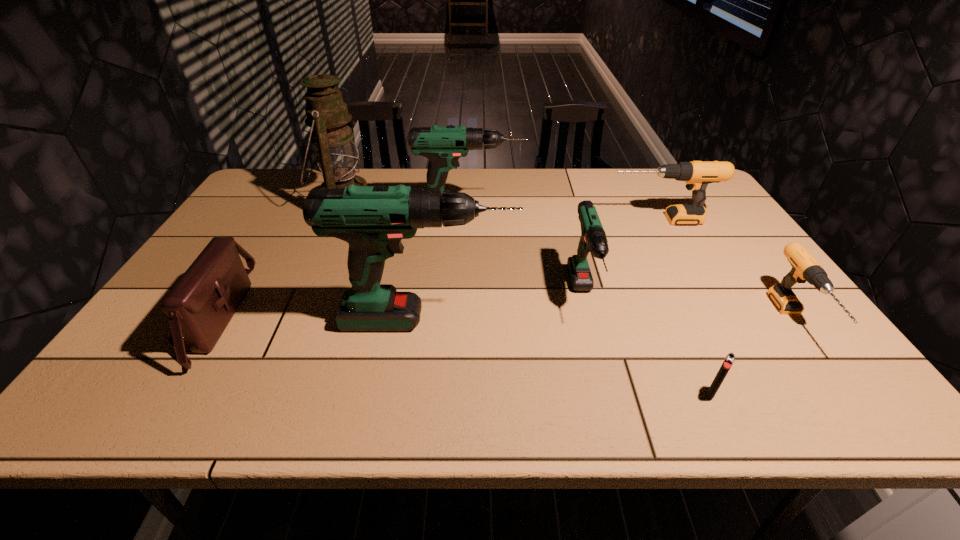
Locate an element on the screen. Image resolution: width=960 pixels, height=540 pixels. the smaller black drill is located at coordinates (805, 268).

Locate an element on the screen. black igniter is located at coordinates (729, 360).

Where is `the shortest object`? The image size is (960, 540). the shortest object is located at coordinates (729, 360).

This screenshot has width=960, height=540. Find the location of `vacant space located on the right of the seventh object from right to left`. vacant space located on the right of the seventh object from right to left is located at coordinates (415, 201).

This screenshot has width=960, height=540. Identify the location of vacant region located 0.210m on the handle side of the tallest drill. (603, 320).

You are a GUI agent. You are given a task and a screenshot of the screen. Output one action in this format:
    pyautogui.click(x=<x>, y=<y>)
    Task: Click on the free region located 0.170m on the handle side of the farthest green drill
    Image resolution: width=960 pixels, height=540 pixels.
    Given the screenshot: What is the action you would take?
    pyautogui.click(x=576, y=214)

Identify the location of vacant point located on the handle side of the third drill from left to right. This screenshot has height=540, width=960. (600, 361).

The width and height of the screenshot is (960, 540). I want to click on free region located 0.110m on the handle side of the bigger black drill, so click(571, 220).

The height and width of the screenshot is (540, 960). What are the coordinates of `vacant area situated on the handle side of the bigger black drill` in the screenshot? It's located at (536, 220).

I want to click on vacant space located on the handle side of the bigger black drill, so click(514, 220).